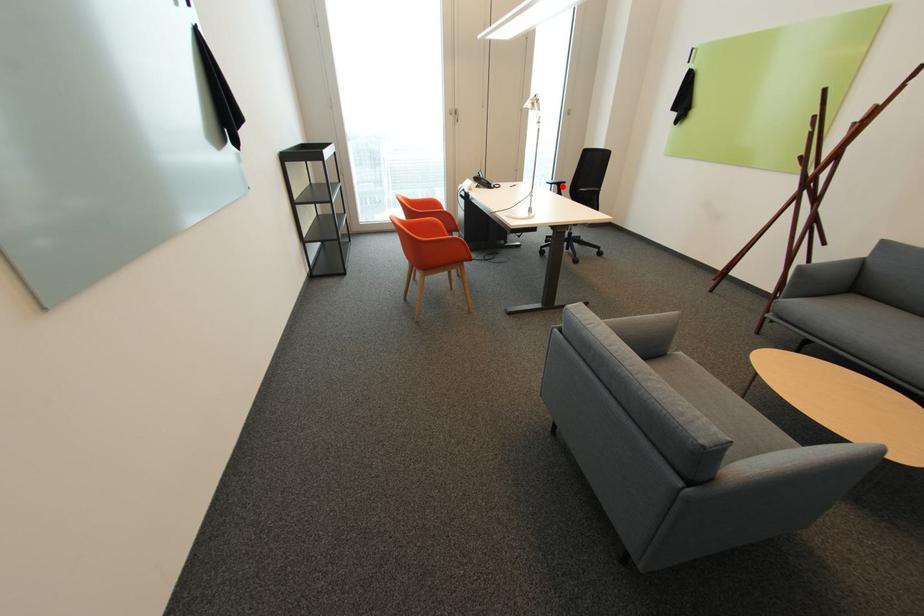
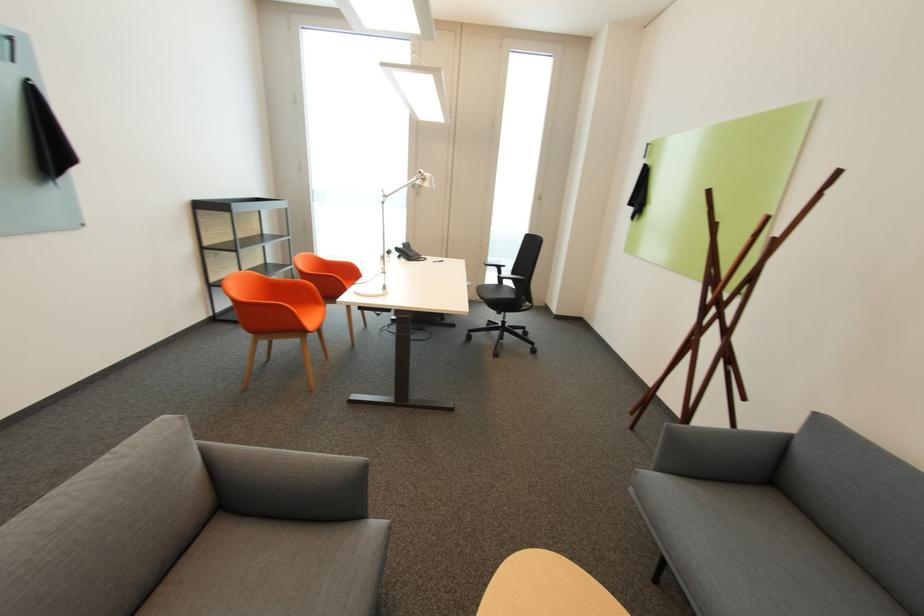
Question: I am providing you with two images of the same scene from different viewpoints. Image1 has a red point marked. In image2, the corresponding 3D location appears at what relative position? Reply with the corresponding letter.

Choices:
 (A) Closer
 (B) Farther

Answer: (A)